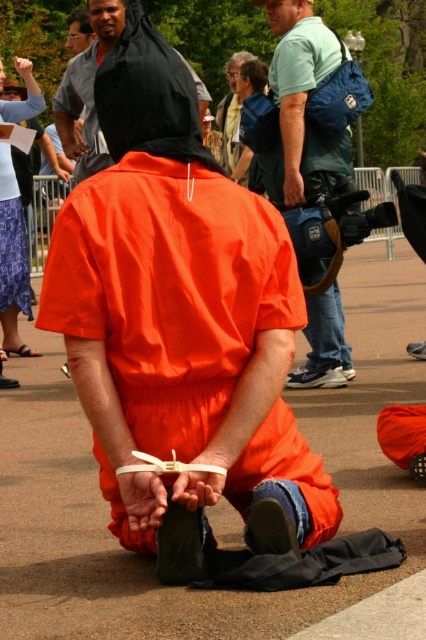
Is point (230, 76) positioned behind point (247, 163)?

Yes, it is.

Does smooth blue shirt at upper center appear on the left side of matte black hoodie at upper center?

Indeed, smooth blue shirt at upper center is positioned on the left side of matte black hoodie at upper center.

Which is behind, point (244, 160) or point (239, 70)?

Point (244, 160)

Locate an element on the screen. smooth blue shirt at upper center is located at coordinates (233, 122).

Looking at this image, can you confirm if orange matte jumpsuit at center is positioned above smooth asphalt pavement at center?

Yes.

Identify the location of orange matte jumpsuit at center. This screenshot has width=426, height=640. (181, 323).

Is orange matte jumpsuit at center below matte black hoodie at upper center?

Yes.

Who is more forward, (89, 301) or (262, 88)?

Point (89, 301) is more forward.

Locate an element on the screen. orange matte jumpsuit at center is located at coordinates (181, 323).